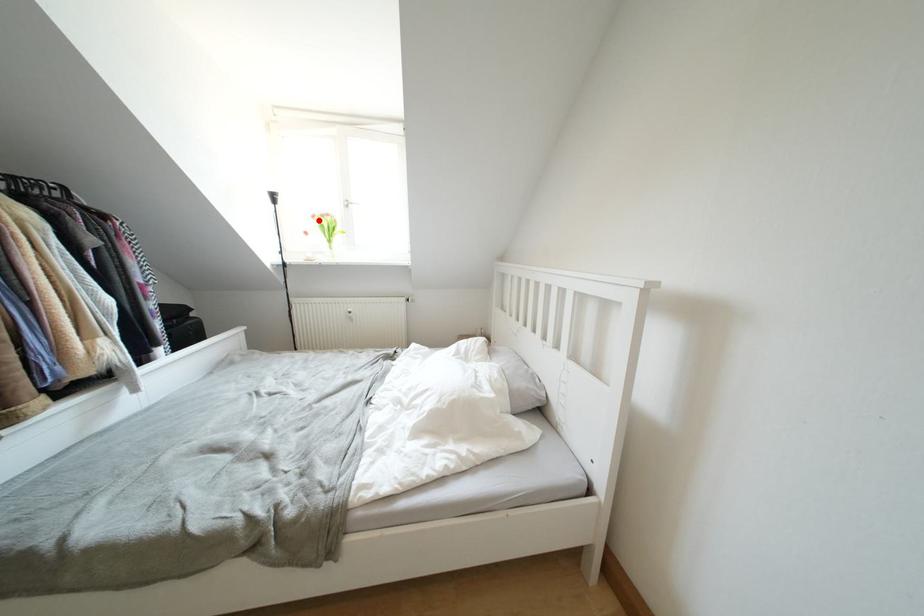
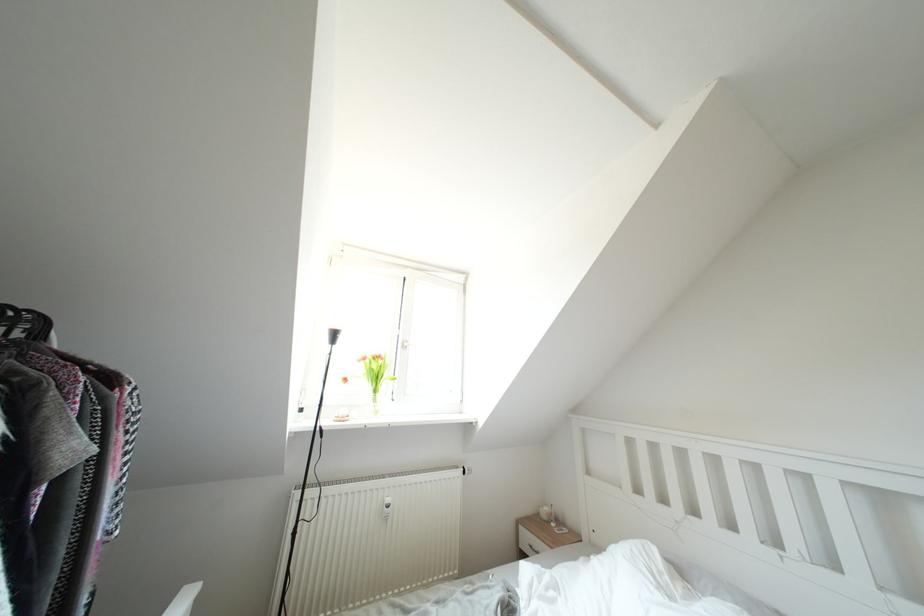
In the second image, find the point that corresponds to the highlighted location in the first image.

(370, 363)